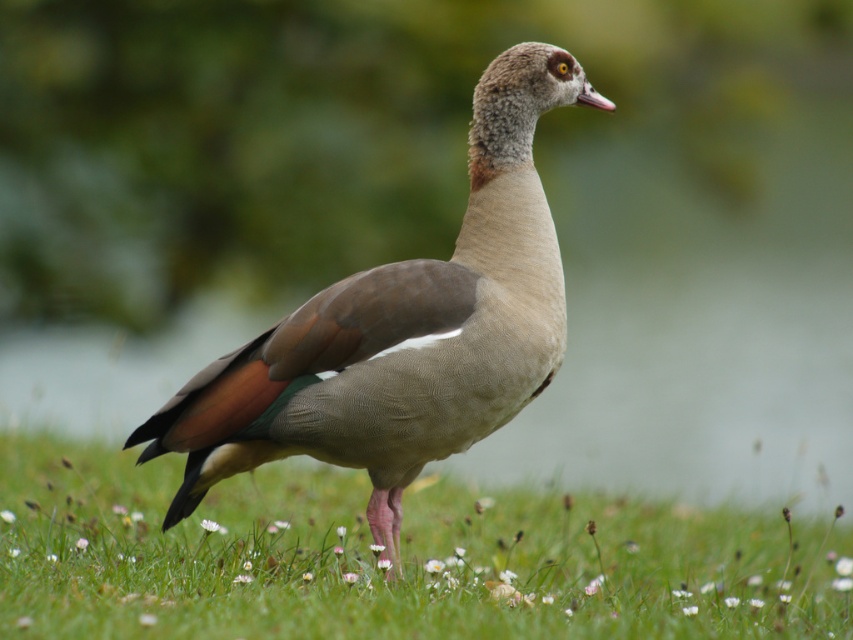
Is green grass at center taller than brown feathered duck at center?

No, green grass at center is not taller than brown feathered duck at center.

Does green grass at center appear over brown feathered duck at center?

Actually, green grass at center is below brown feathered duck at center.

Is point (119, 516) positioned before point (399, 352)?

No, it is behind (399, 352).

This screenshot has height=640, width=853. What are the coordinates of `green grass at center` in the screenshot? It's located at (374, 560).